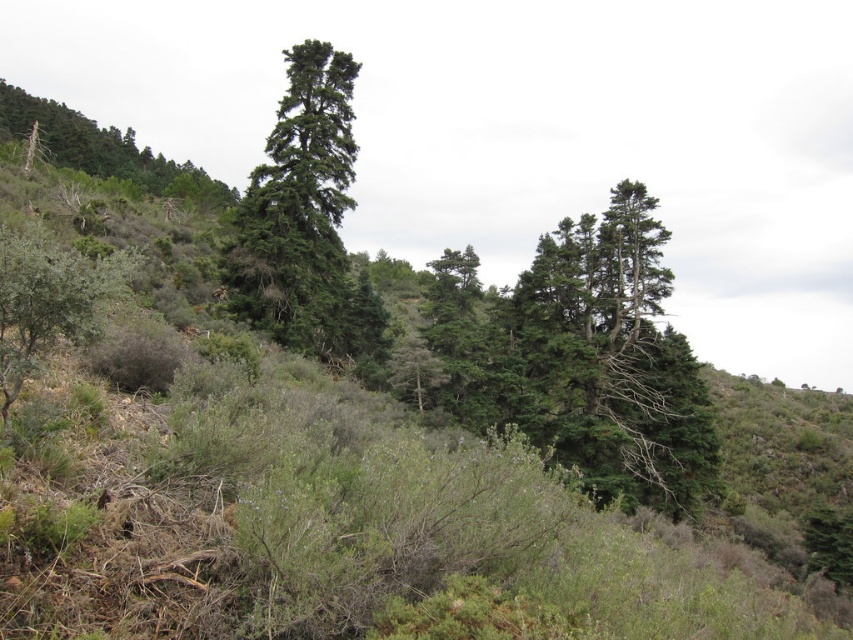
Question: Estimate the real-world distances between objects in this image. Which object is farther from the green leafy tree at upper left?

Choices:
 (A) green matte tree at center
 (B) green needle-like tree at center
 (C) green leafy bush at lower left

Answer: (C)

Question: Does green needle-like tree at center have a larger size compared to green leafy bush at lower left?

Choices:
 (A) yes
 (B) no

Answer: (A)

Question: Which of the following is the farthest from the observer?

Choices:
 (A) (61, 300)
 (B) (202, 204)

Answer: (B)

Question: Is green needle-like tree at center further to the viewer compared to green leafy tree at upper left?

Choices:
 (A) yes
 (B) no

Answer: (B)

Question: Which object is positioned farthest from the green leafy bush at lower left?

Choices:
 (A) green needle-like tree at center
 (B) green matte tree at center

Answer: (B)

Question: Does green needle-like tree at center appear under green leafy tree at upper left?

Choices:
 (A) yes
 (B) no

Answer: (A)